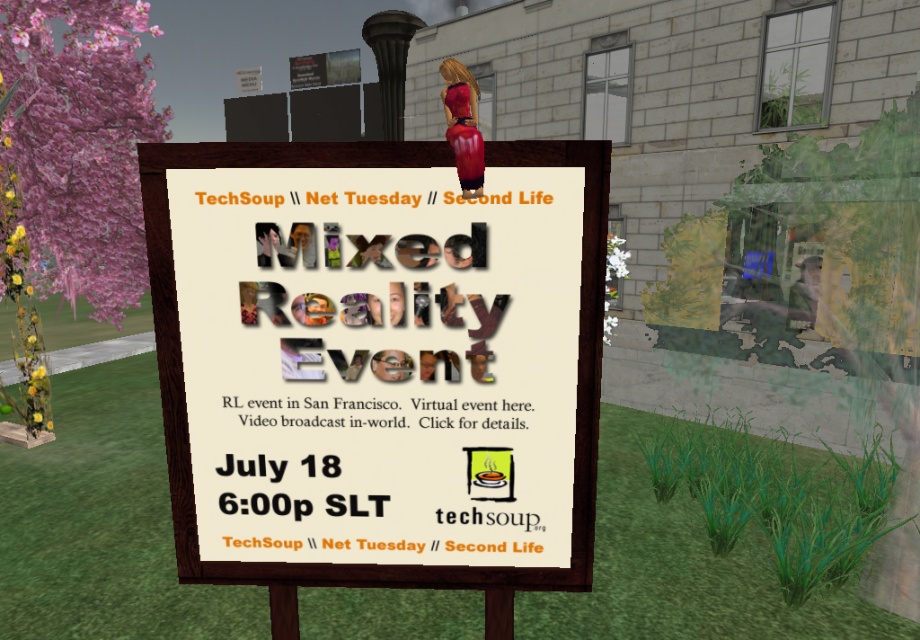
Does matte paper sign at center have a lesser height compared to pink floral tree at left?

Indeed, matte paper sign at center has a lesser height compared to pink floral tree at left.

Does point (524, 454) lie in front of point (71, 182)?

Yes, point (524, 454) is in front of point (71, 182).

This screenshot has height=640, width=920. Describe the element at coordinates (378, 360) in the screenshot. I see `matte paper sign at center` at that location.

At what (x,y) coordinates should I click in order to perform the action: click on matte paper sign at center. Please return your answer as a coordinate pair (x, y). The height and width of the screenshot is (640, 920). Looking at the image, I should click on (378, 360).

Can you confirm if matte paper sign at center is shorter than green grass at center?

No, matte paper sign at center is not shorter than green grass at center.

What do you see at coordinates (378, 360) in the screenshot? I see `matte paper sign at center` at bounding box center [378, 360].

Image resolution: width=920 pixels, height=640 pixels. Find the location of `matte paper sign at center`. matte paper sign at center is located at coordinates (378, 360).

Who is positioned more to the right, green grass at center or pink floral tree at left?

Positioned to the right is green grass at center.

This screenshot has width=920, height=640. Find the location of `green grass at center`. green grass at center is located at coordinates (102, 524).